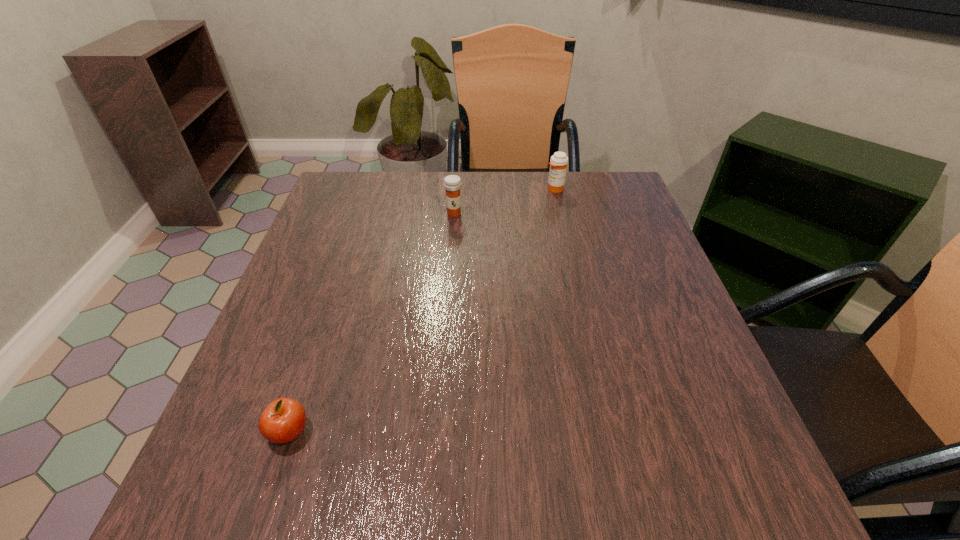
This screenshot has width=960, height=540. I want to click on vacant space at the far edge of the desktop, so click(474, 187).

The height and width of the screenshot is (540, 960). In order to click on vacant region at the near edge of the desktop in this screenshot , I will do click(x=531, y=494).

In the image, there is a desktop. Where is `free space at the left edge`? free space at the left edge is located at coordinates (338, 230).

Where is `free space at the right edge of the desktop`? free space at the right edge of the desktop is located at coordinates (658, 326).

At what (x,y) coordinates should I click in order to perform the action: click on vacant space at the far left corner of the desktop. Please return your answer as a coordinate pair (x, y). Looking at the image, I should click on (364, 219).

Identify the location of vacant space at the near right corner. (671, 457).

This screenshot has width=960, height=540. Find the location of `free space between the nearer medicine and the apple`. free space between the nearer medicine and the apple is located at coordinates (372, 323).

Identify the location of free space between the second nearest object and the apple. The height and width of the screenshot is (540, 960). click(x=372, y=323).

Identify the location of empty space that is in between the right medicine and the second farthest object. (504, 201).

Locate an element on the screen. The image size is (960, 540). free space between the nearest object and the second object from right to left is located at coordinates (372, 323).